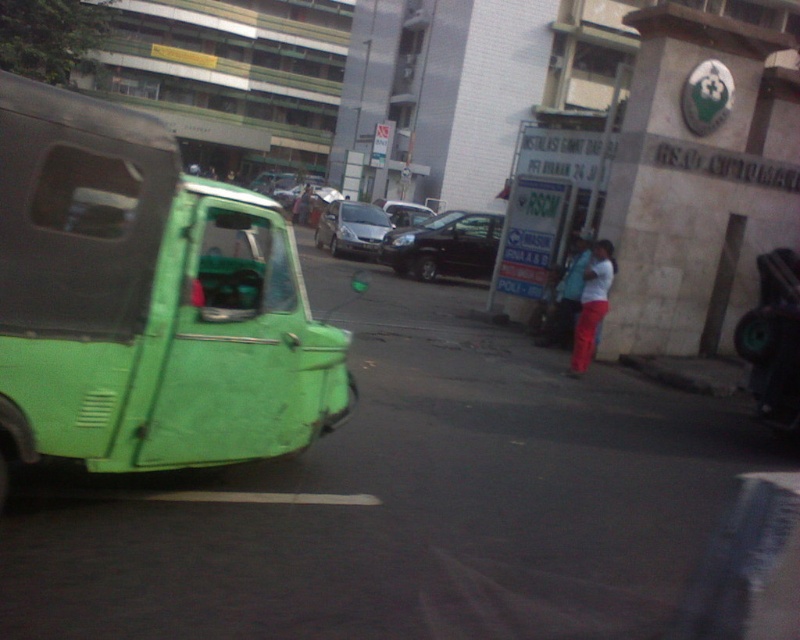
Question: Which object is farther from the camera taking this photo?

Choices:
 (A) white matte shirt at center
 (B) satin silver car at center
 (C) green matte van at left
 (D) blue fabric jacket at center

Answer: (B)

Question: Does shiny black car at center appear on the left side of blue fabric jacket at center?

Choices:
 (A) no
 (B) yes

Answer: (B)

Question: Is white matte shirt at center positioned behind blue fabric jacket at center?

Choices:
 (A) yes
 (B) no

Answer: (B)

Question: Which of the following is the farthest from the observer?

Choices:
 (A) (336, 227)
 (B) (245, 337)

Answer: (A)

Question: Is shiny black car at center thinner than blue fabric jacket at center?

Choices:
 (A) no
 (B) yes

Answer: (A)

Question: Among these objects, which one is farthest from the camera?

Choices:
 (A) white matte shirt at center
 (B) green matte van at left
 (C) satin silver car at center
 (D) blue fabric jacket at center

Answer: (C)